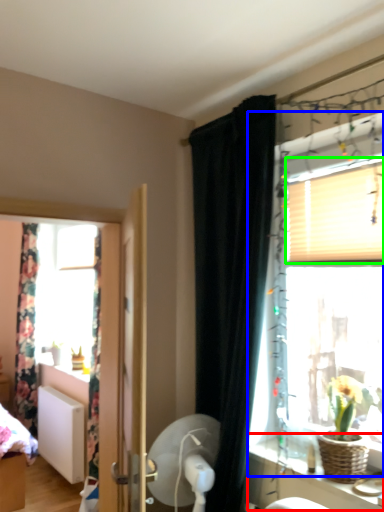
Question: Which object is the farthest from vanity (highlighted by a red box)? Choose among these: window (highlighted by a blue box) or blind (highlighted by a green box).

Choices:
 (A) window
 (B) blind

Answer: (B)